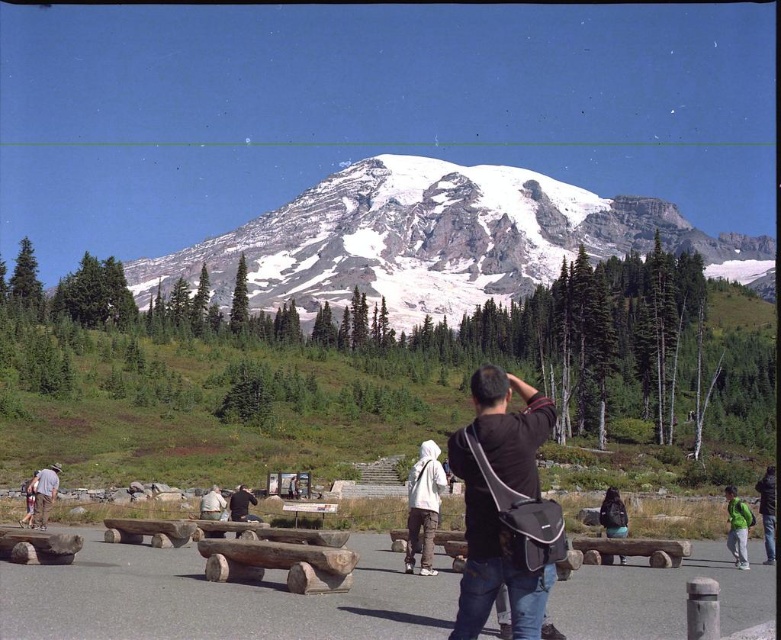
Question: Is snowy granite mountain at center wider than denim jacket at lower left?

Choices:
 (A) no
 (B) yes

Answer: (B)

Question: Which of the following is the closest to the observer?

Choices:
 (A) (20, 522)
 (B) (730, 509)

Answer: (B)

Question: Which object appears closest to the camera in this image?

Choices:
 (A) denim jacket at lower left
 (B) green fabric backpack at lower right

Answer: (B)

Question: Does snowy granite mountain at center have a larger size compared to black fabric bag at center?

Choices:
 (A) no
 (B) yes

Answer: (B)

Question: Does green fabric jacket at lower right have a greater width compared to khaki pants at center?

Choices:
 (A) yes
 (B) no

Answer: (A)

Question: Which of the following is the closest to the observer?

Choices:
 (A) (626, 509)
 (B) (27, 513)
 (C) (744, 554)
 (D) (45, 472)

Answer: (C)